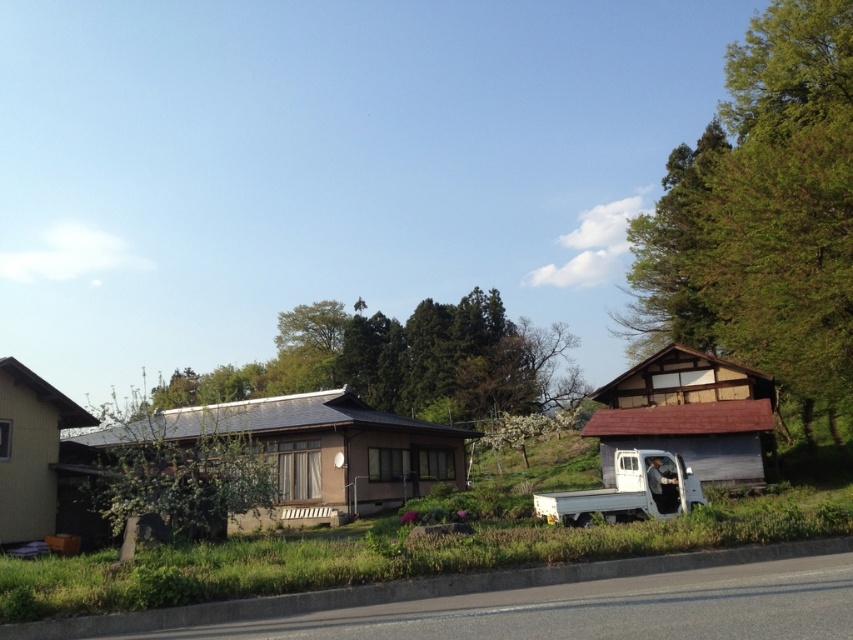
Question: Which point is closer to the camera taking this photo?

Choices:
 (A) coord(807,262)
 (B) coord(219,528)

Answer: (B)

Question: Which object appears farthest from the camera in this image?

Choices:
 (A) green leafy tree at center
 (B) green leafy tree at right

Answer: (B)

Question: Does green leafy tree at right appear over green leafy tree at center?

Choices:
 (A) no
 (B) yes

Answer: (B)

Question: Is green leafy tree at right below green leafy tree at center?

Choices:
 (A) no
 (B) yes

Answer: (A)

Question: Does green leafy tree at right appear on the left side of green leafy tree at center?

Choices:
 (A) yes
 (B) no

Answer: (B)